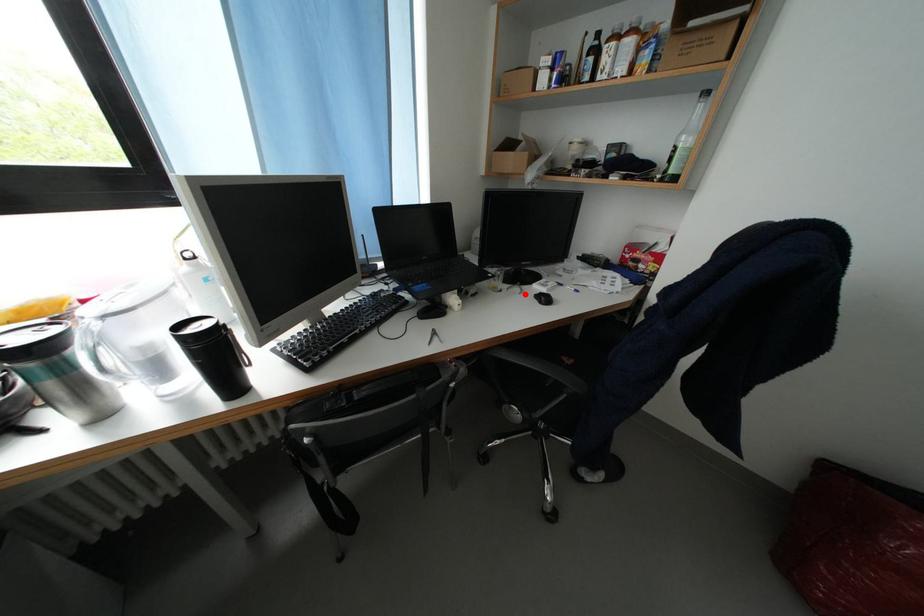
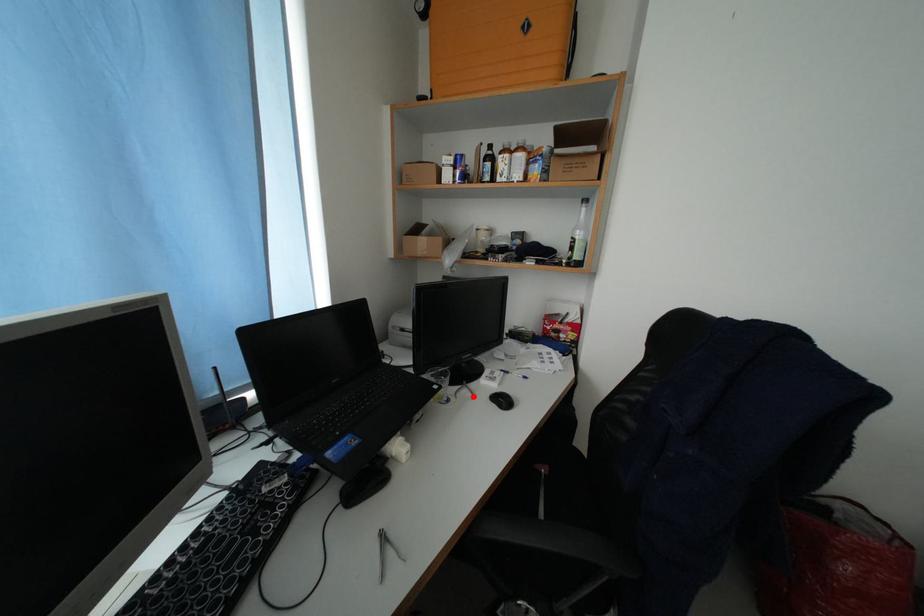
I am providing you with two images of the same scene from different viewpoints. A red point is marked on the first image and another point is marked on the second image. Do the highlighted points in image1 and image2 indicate the same real-world spot?

Yes